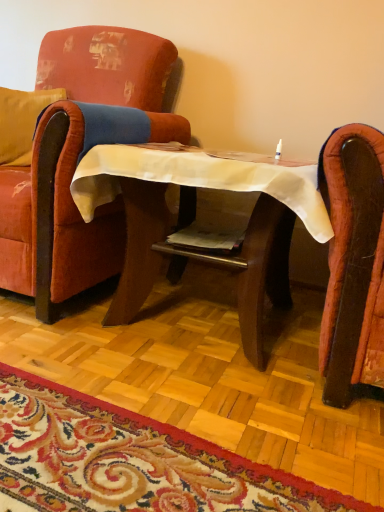
At what (x,y) coordinates should I click in order to perform the action: click on velvet yellow pillow at left. Please return your answer as a coordinate pair (x, y). Looking at the image, I should click on (22, 122).

This screenshot has height=512, width=384. What do you see at coordinates (79, 159) in the screenshot? I see `velvet red armchair at left` at bounding box center [79, 159].

Identify the location of carpet with floral pattern at lower center. (130, 460).

Could you tell me if carpet with floral pattern at lower center is facing velvet red armchair at left?

No.

Considering the sizes of carpet with floral pattern at lower center and velvet red armchair at left in the image, is carpet with floral pattern at lower center bigger or smaller than velvet red armchair at left?

Clearly, carpet with floral pattern at lower center is smaller in size than velvet red armchair at left.

Considering the sizes of objects carpet with floral pattern at lower center and velvet red armchair at left in the image provided, who is taller, carpet with floral pattern at lower center or velvet red armchair at left?

velvet red armchair at left is taller.

From a real-world perspective, is velvet yellow pillow at left positioned above or below carpet with floral pattern at lower center?

velvet yellow pillow at left is above carpet with floral pattern at lower center.

Is velvet yellow pillow at left aimed at carpet with floral pattern at lower center?

No, velvet yellow pillow at left is not oriented towards carpet with floral pattern at lower center.

From the image's perspective, which is above, velvet yellow pillow at left or carpet with floral pattern at lower center?

From the image's view, velvet yellow pillow at left is above.

Is wooden table at center wider or thinner than carpet with floral pattern at lower center?

wooden table at center is thinner than carpet with floral pattern at lower center.

Is wooden table at center directly adjacent to carpet with floral pattern at lower center?

wooden table at center and carpet with floral pattern at lower center are clearly separated.

Based on their positions, is wooden table at center located to the left or right of carpet with floral pattern at lower center?

Clearly, wooden table at center is on the right of carpet with floral pattern at lower center in the image.

From their relative heights in the image, would you say wooden table at center is taller or shorter than carpet with floral pattern at lower center?

wooden table at center is taller than carpet with floral pattern at lower center.

Between carpet with floral pattern at lower center and wooden table at center, which one is positioned in front?

carpet with floral pattern at lower center is in front.

Would you consider carpet with floral pattern at lower center to be distant from wooden table at center?

No, carpet with floral pattern at lower center is in close proximity to wooden table at center.

In the scene shown: Visually, is carpet with floral pattern at lower center positioned to the left or to the right of wooden table at center?

Clearly, carpet with floral pattern at lower center is on the left of wooden table at center in the image.

Is carpet with floral pattern at lower center looking in the opposite direction of wooden table at center?

No, carpet with floral pattern at lower center's orientation is not away from wooden table at center.

Visually, is carpet with floral pattern at lower center positioned to the left or to the right of velvet yellow pillow at left?

In the image, carpet with floral pattern at lower center appears on the right side of velvet yellow pillow at left.

Is velvet yellow pillow at left a part of carpet with floral pattern at lower center?

No, velvet yellow pillow at left is located outside of carpet with floral pattern at lower center.

Considering the positions of point (179, 495) and point (15, 164), is point (179, 495) closer or farther from the camera than point (15, 164)?

Point (179, 495) is positioned closer to the camera compared to point (15, 164).

From the image's perspective, who appears lower, carpet with floral pattern at lower center or velvet yellow pillow at left?

carpet with floral pattern at lower center.

Based on the photo, can you confirm if velvet yellow pillow at left is positioned to the right of velvet red armchair at left?

In fact, velvet yellow pillow at left is to the left of velvet red armchair at left.

In the scene shown: Is velvet yellow pillow at left in contact with velvet red armchair at left?

velvet yellow pillow at left is not next to velvet red armchair at left, and they're not touching.

Can you confirm if velvet yellow pillow at left is taller than velvet red armchair at left?

No, velvet yellow pillow at left is not taller than velvet red armchair at left.

From the image's perspective, is velvet yellow pillow at left located above or below velvet red armchair at left?

velvet yellow pillow at left is above velvet red armchair at left.

From a real-world perspective, between velvet red armchair at left and carpet with floral pattern at lower center, who is vertically lower?

In real-world perspective, carpet with floral pattern at lower center is lower.

How different are the orientations of velvet red armchair at left and carpet with floral pattern at lower center in degrees?

90 degrees separate the facing orientations of velvet red armchair at left and carpet with floral pattern at lower center.

Between velvet red armchair at left and carpet with floral pattern at lower center, which one appears on the left side from the viewer's perspective?

velvet red armchair at left is more to the left.

Identify the location of chair above the carpet with floral pattern at lower center (from a real-world perspective). click(79, 159).

I want to click on mat that appears below the velvet red armchair at left (from a real-world perspective), so click(x=130, y=460).

I want to click on pillow located above the carpet with floral pattern at lower center (from the image's perspective), so click(x=22, y=122).

Estimate the real-world distances between objects in this image. Which object is closer to wooden table at center, velvet red armchair at left or carpet with floral pattern at lower center?

velvet red armchair at left.

Which object lies nearer to the anchor point velvet red armchair at left, velvet yellow pillow at left or carpet with floral pattern at lower center?

velvet yellow pillow at left.

Looking at the image, which one is located further to carpet with floral pattern at lower center, wooden table at center or velvet red armchair at left?

Based on the image, velvet red armchair at left appears to be further to carpet with floral pattern at lower center.

From the image, which object appears to be nearer to velvet yellow pillow at left, carpet with floral pattern at lower center or velvet red armchair at left?

Among the two, velvet red armchair at left is located nearer to velvet yellow pillow at left.

Which object lies nearer to the anchor point velvet red armchair at left, carpet with floral pattern at lower center or wooden table at center?

Among the two, wooden table at center is located nearer to velvet red armchair at left.

When comparing their distances from wooden table at center, does carpet with floral pattern at lower center or velvet red armchair at left seem closer?

velvet red armchair at left is positioned closer to the anchor wooden table at center.

Looking at the image, which one is located closer to wooden table at center, carpet with floral pattern at lower center or velvet yellow pillow at left?

Based on the image, carpet with floral pattern at lower center appears to be nearer to wooden table at center.

Looking at the image, which one is located further to velvet yellow pillow at left, carpet with floral pattern at lower center or wooden table at center?

→ carpet with floral pattern at lower center.

Locate an element on the screen. table that lies between velvet red armchair at left and carpet with floral pattern at lower center from top to bottom is located at coordinates (205, 220).

Identify the location of chair located between carpet with floral pattern at lower center and velvet yellow pillow at left in the depth direction. (79, 159).

The width and height of the screenshot is (384, 512). In order to click on table between carpet with floral pattern at lower center and velvet yellow pillow at left from front to back in this screenshot , I will do `click(205, 220)`.

You are a GUI agent. You are given a task and a screenshot of the screen. Output one action in this format:
    pyautogui.click(x=<x>, y=<y>)
    Task: Click on the chair situated between velvet yellow pillow at left and wooden table at center from left to right
    The image size is (384, 512).
    Given the screenshot: What is the action you would take?
    pyautogui.click(x=79, y=159)